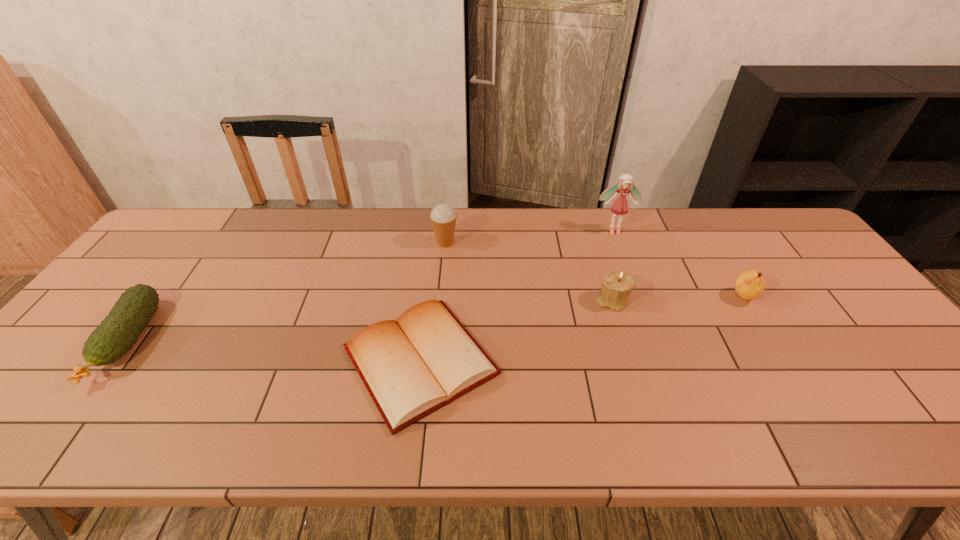
This screenshot has width=960, height=540. Find the location of `doll`. doll is located at coordinates [620, 206].

At what (x,y) coordinates should I click in order to perform the action: click on the fifth shortest object. Please return your answer as a coordinate pair (x, y). The height and width of the screenshot is (540, 960). Looking at the image, I should click on (443, 217).

I want to click on candle_holder, so click(x=617, y=285).

Identify the location of pear. (749, 285).

The width and height of the screenshot is (960, 540). In order to click on cucumber in this screenshot , I will do `click(118, 332)`.

Locate an element on the screen. the fifth tallest object is located at coordinates (118, 332).

I want to click on Bible, so click(x=411, y=367).

This screenshot has width=960, height=540. What are the coordinates of `vacant space located on the front-facing side of the tallest object` in the screenshot? It's located at (622, 253).

At what (x,y) coordinates should I click in order to perform the action: click on vacant position located on the front of the icecream. Please return your answer as a coordinate pair (x, y). Looking at the image, I should click on [x=443, y=268].

At what (x,y) coordinates should I click in order to perform the action: click on vacant space situated on the left of the candle_holder. Please return your answer as a coordinate pair (x, y). The height and width of the screenshot is (540, 960). Looking at the image, I should click on (504, 300).